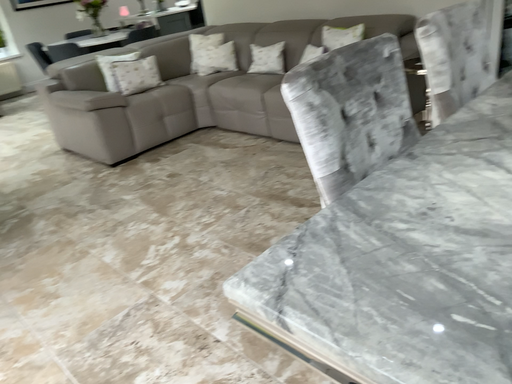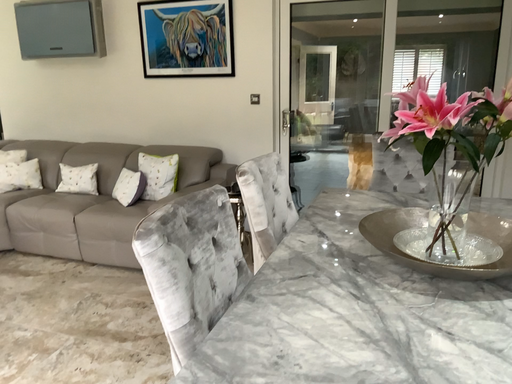
Question: Which way did the camera rotate in the video?

Choices:
 (A) rotated upward
 (B) rotated downward

Answer: (A)